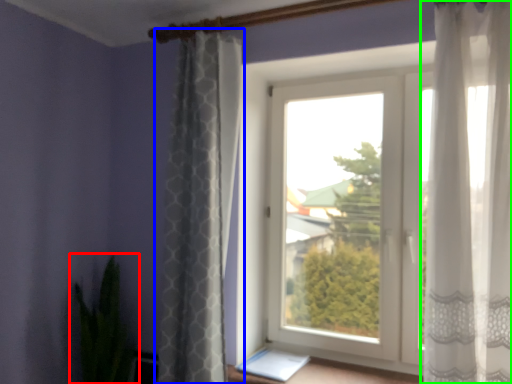
Question: Which object is positioned farthest from houseplant (highlighted by a red box)? Select from curtain (highlighted by a blue box) and curtain (highlighted by a green box).

Choices:
 (A) curtain
 (B) curtain

Answer: (B)